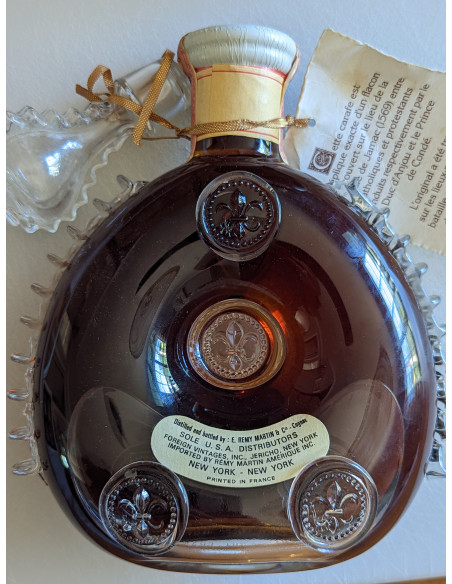
Identify the location of window reflecting off glass. (158, 371).